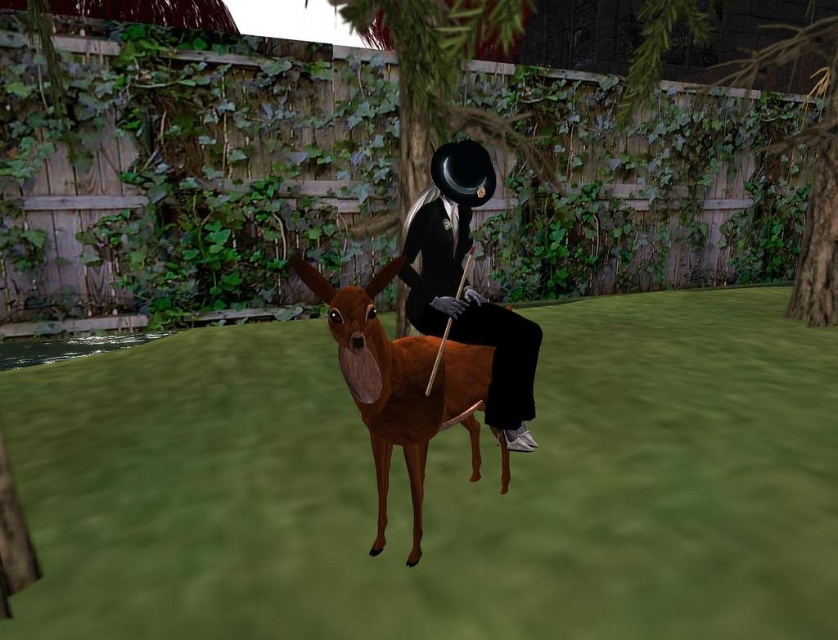
Question: Which object appears farthest from the camera in this image?

Choices:
 (A) brown matte/deer at center
 (B) matte black suit at center

Answer: (B)

Question: Is the position of brown matte/deer at center more distant than that of matte black suit at center?

Choices:
 (A) no
 (B) yes

Answer: (A)

Question: Does brown matte/deer at center appear under matte black suit at center?

Choices:
 (A) yes
 (B) no

Answer: (A)

Question: Can you confirm if brown matte/deer at center is positioned below matte black suit at center?

Choices:
 (A) no
 (B) yes

Answer: (B)